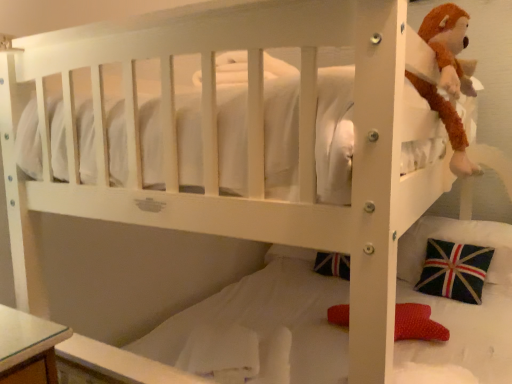
The width and height of the screenshot is (512, 384). Identify the location of brown plush monkey at upper right. (447, 42).

What do you see at coordinates (447, 42) in the screenshot? I see `brown plush monkey at upper right` at bounding box center [447, 42].

I want to click on brown plush monkey at upper right, so click(x=447, y=42).